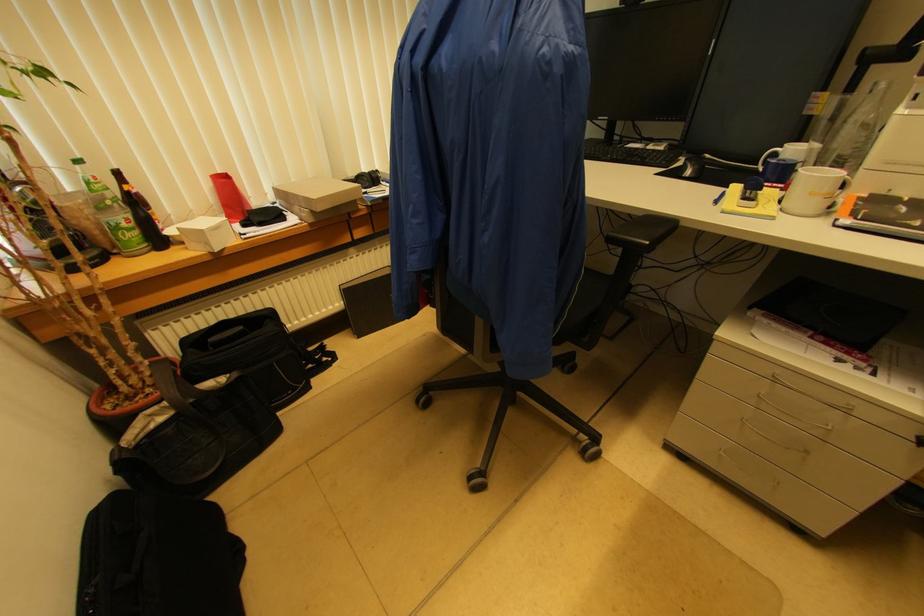
Locate an element on the screen. The image size is (924, 616). blue mug handle is located at coordinates (776, 169).